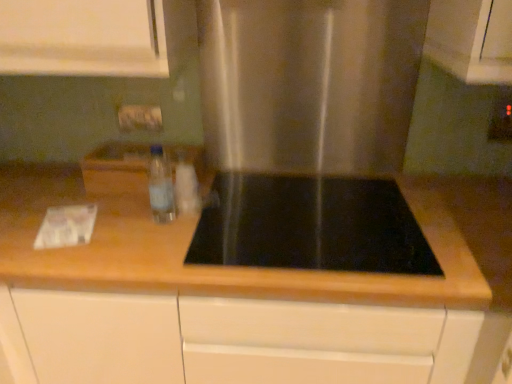
The height and width of the screenshot is (384, 512). What are the coordinates of `free spot in front of translucent plastic bottle at center, acting as the second bottle starting from the left` in the screenshot? It's located at (172, 232).